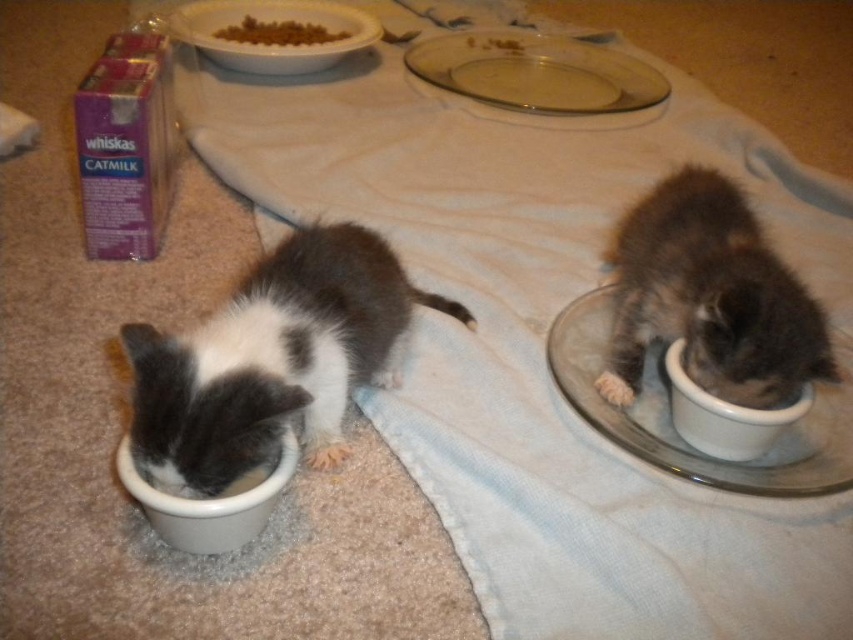
Question: Is transparent glass plate at upper center wider than clear glass plate at upper center?

Choices:
 (A) no
 (B) yes

Answer: (A)

Question: Which of these objects is positioned closest to the clear glass plate at upper center?

Choices:
 (A) transparent glass plate at upper center
 (B) brown crumbly food at upper center
 (C) white matte bowl at lower left

Answer: (B)

Question: Can you confirm if transparent glass plate at upper center is positioned below white ceramic plate at upper center?

Choices:
 (A) yes
 (B) no

Answer: (A)

Question: Among these objects, which one is farthest from the camera?

Choices:
 (A) clear glass plate at upper center
 (B) brown crumbly food at upper center
 (C) white glossy bowl at right
 (D) white-furred cat at left

Answer: (B)

Question: Observing the image, what is the correct spatial positioning of white-furred cat at left in reference to clear glass plate at upper center?

Choices:
 (A) left
 (B) right

Answer: (A)

Question: Among these points, which one is nearest to the camera?

Choices:
 (A) (764, 442)
 (B) (683, 445)
 (C) (138, 493)
 (D) (318, 28)

Answer: (C)